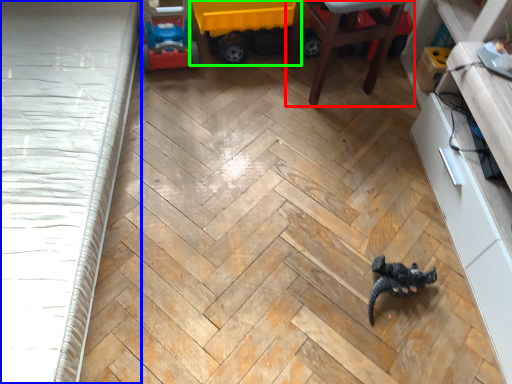
Question: Estimate the real-world distances between objects in this image. Which object is farther from furniture (highlighted by a red box), bed frame (highlighted by a blue box) or toy (highlighted by a green box)?

Choices:
 (A) bed frame
 (B) toy

Answer: (A)